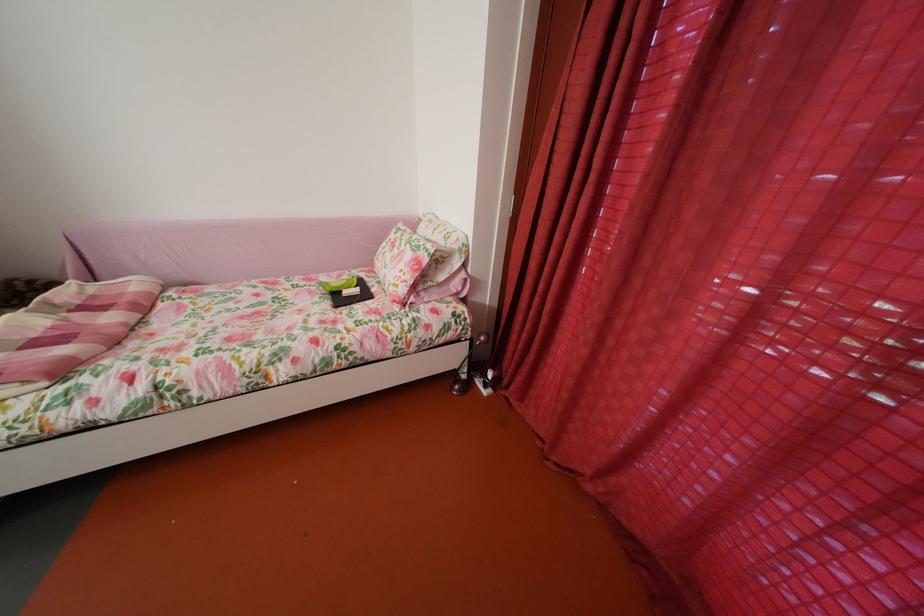
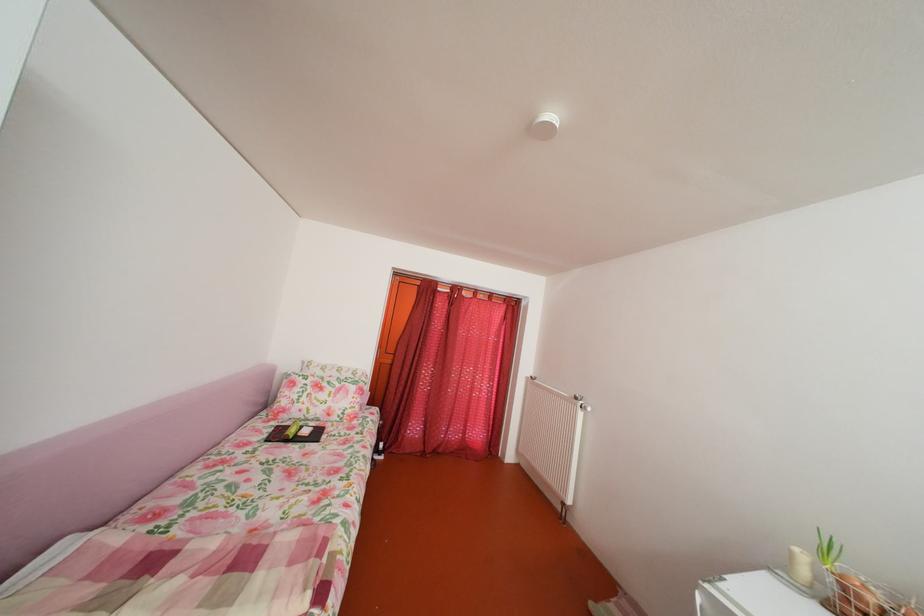
Find the pixel in the second image that matches point (373, 281) in the first image.

(286, 430)